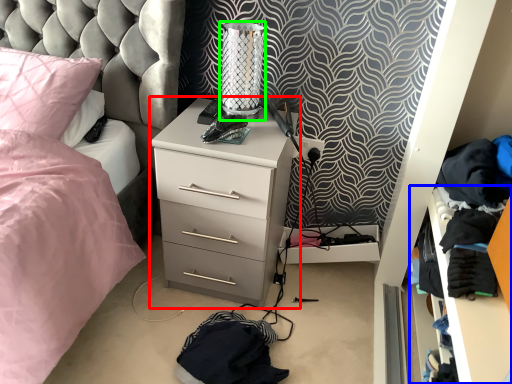
Question: Considering the real-world distances, which object is closest to chest of drawers (highlighted by a red box)? shelf (highlighted by a blue box) or table lamp (highlighted by a green box).

Choices:
 (A) shelf
 (B) table lamp

Answer: (B)